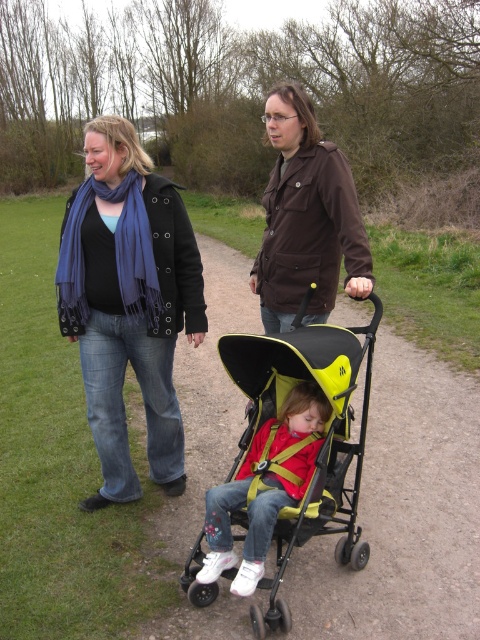
You are a photographer trying to capture a candid shot of the two adults in the park. You want to ensure that both the matte black coat at center and the brown matte jacket at upper center are visible in the frame. Based on their positions, which adult is standing to the left of the other?

The matte black coat at center is positioned on the left side of brown matte jacket at upper center, so the adult wearing the matte black coat at center is standing to the left of the adult in the brown matte jacket at upper center.

You are a fashion designer observing two jackets in a park scene. The jackets are the matte black coat at center and the brown matte jacket at upper center. Which one is bigger in size?

The matte black coat at center is larger in size compared to the brown matte jacket at upper center.

You are a photographer trying to capture a candid shot of the adults and child in the park. You want to ensure that both the matte black coat at center and the matte yellow stroller at center are clearly visible in the frame. Given their sizes, which object should you focus on to ensure both are in the frame without needing to adjust your camera angle?

The matte black coat at center is wider than the matte yellow stroller at center, so focusing on the matte black coat at center will ensure both objects are captured in the frame since it requires a wider angle, accommodating the stroller as well.